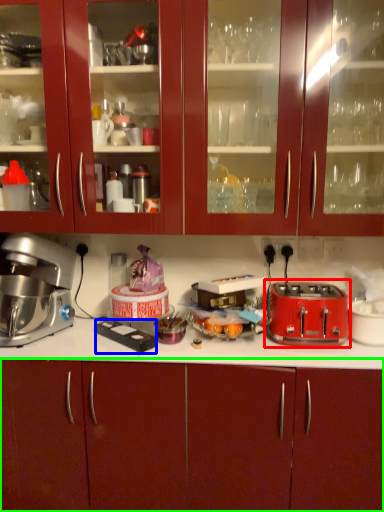
Question: Estimate the real-world distances between objects in this image. Which object is closer to toaster (highlighted by a red box), appliance (highlighted by a blue box) or cabinetry (highlighted by a green box)?

Choices:
 (A) appliance
 (B) cabinetry

Answer: (B)